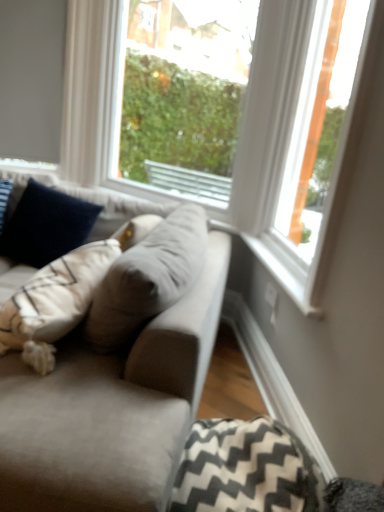
Question: Is velvety navy blue pillow at left, marked as the second pillow in a bottom-to-top arrangement, shorter than suede gray couch at center?

Choices:
 (A) yes
 (B) no

Answer: (A)

Question: Is velvety navy blue pillow at left, which appears as the 2th pillow when viewed from the front, further to the viewer compared to suede gray couch at center?

Choices:
 (A) no
 (B) yes

Answer: (B)

Question: Can you confirm if velvety navy blue pillow at left, the 1th pillow viewed from the top, is thinner than suede gray couch at center?

Choices:
 (A) no
 (B) yes

Answer: (B)

Question: Would you say velvety navy blue pillow at left, which is the first pillow from left to right, is outside suede gray couch at center?

Choices:
 (A) yes
 (B) no

Answer: (B)

Question: Could you tell me if velvety navy blue pillow at left, which appears as the 1th pillow when viewed from the back, is facing suede gray couch at center?

Choices:
 (A) yes
 (B) no

Answer: (A)

Question: Is velvety navy blue pillow at left, the 1th pillow viewed from the top, far from suede gray couch at center?

Choices:
 (A) yes
 (B) no

Answer: (B)

Question: Are suede gray couch at center and transparent glass window at center, the first window in the left-to-right sequence, located far from each other?

Choices:
 (A) yes
 (B) no

Answer: (A)

Question: Can you confirm if suede gray couch at center is smaller than transparent glass window at center, the first window in the left-to-right sequence?

Choices:
 (A) no
 (B) yes

Answer: (A)

Question: Can we say suede gray couch at center lies outside transparent glass window at center, which is counted as the 2th window, starting from the right?

Choices:
 (A) no
 (B) yes

Answer: (B)

Question: Is suede gray couch at center at the right side of transparent glass window at center, the first window in the left-to-right sequence?

Choices:
 (A) yes
 (B) no

Answer: (B)

Question: From the image's perspective, does suede gray couch at center appear lower than transparent glass window at center, which is counted as the 2th window, starting from the right?

Choices:
 (A) no
 (B) yes

Answer: (B)

Question: From a real-world perspective, is suede gray couch at center below transparent glass window at center, which is counted as the 2th window, starting from the right?

Choices:
 (A) yes
 (B) no

Answer: (A)

Question: From the image's perspective, is transparent glass window at center, the first window in the left-to-right sequence, above velvety navy blue pillow at left, which is the first pillow from left to right?

Choices:
 (A) no
 (B) yes

Answer: (B)